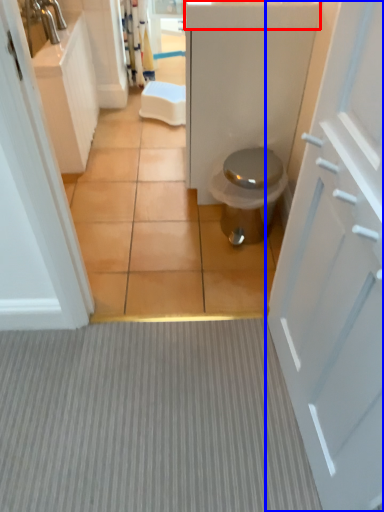
Question: Among these objects, which one is farthest to the camera, counter top (highlighted by a red box) or door (highlighted by a blue box)?

Choices:
 (A) counter top
 (B) door

Answer: (A)